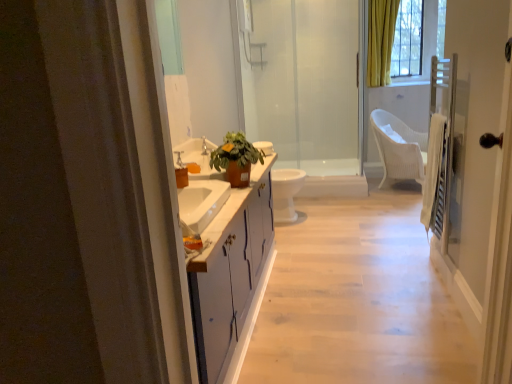
Question: Is transparent glass screen door at right positioned beyond the bounds of matte brown pot at center?

Choices:
 (A) yes
 (B) no

Answer: (A)

Question: Considering the relative positions of transparent glass screen door at right and matte brown pot at center in the image provided, is transparent glass screen door at right to the right of matte brown pot at center from the viewer's perspective?

Choices:
 (A) yes
 (B) no

Answer: (A)

Question: Can matte brown pot at center be found inside transparent glass screen door at right?

Choices:
 (A) yes
 (B) no

Answer: (B)

Question: Can you confirm if transparent glass screen door at right is positioned to the left of matte brown pot at center?

Choices:
 (A) no
 (B) yes

Answer: (A)

Question: Is transparent glass screen door at right bigger than matte brown pot at center?

Choices:
 (A) no
 (B) yes

Answer: (B)

Question: Considering their positions, is white wicker chair at center located in front of or behind white glossy cabinet at center?

Choices:
 (A) front
 (B) behind

Answer: (B)

Question: Visually, is white wicker chair at center positioned to the left or to the right of white glossy cabinet at center?

Choices:
 (A) left
 (B) right

Answer: (B)

Question: Does point (407, 140) appear closer or farther from the camera than point (328, 200)?

Choices:
 (A) farther
 (B) closer

Answer: (A)

Question: Choose the correct answer: Is white wicker chair at center inside white glossy cabinet at center or outside it?

Choices:
 (A) outside
 (B) inside

Answer: (A)

Question: Which is correct: transparent glass shower door at center is inside white glossy toilet at center, or outside of it?

Choices:
 (A) outside
 (B) inside

Answer: (A)

Question: From the image's perspective, relative to white glossy toilet at center, is transparent glass shower door at center above or below?

Choices:
 (A) below
 (B) above

Answer: (B)

Question: Looking at the image, does transparent glass shower door at center seem bigger or smaller compared to white glossy toilet at center?

Choices:
 (A) big
 (B) small

Answer: (A)

Question: Does point (345, 190) appear closer or farther from the camera than point (297, 190)?

Choices:
 (A) farther
 (B) closer

Answer: (A)

Question: From the image's perspective, is matte brown pot at center located above or below transparent glass shower door at center?

Choices:
 (A) above
 (B) below

Answer: (B)

Question: Visually, is matte brown pot at center positioned to the left or to the right of transparent glass shower door at center?

Choices:
 (A) left
 (B) right

Answer: (A)